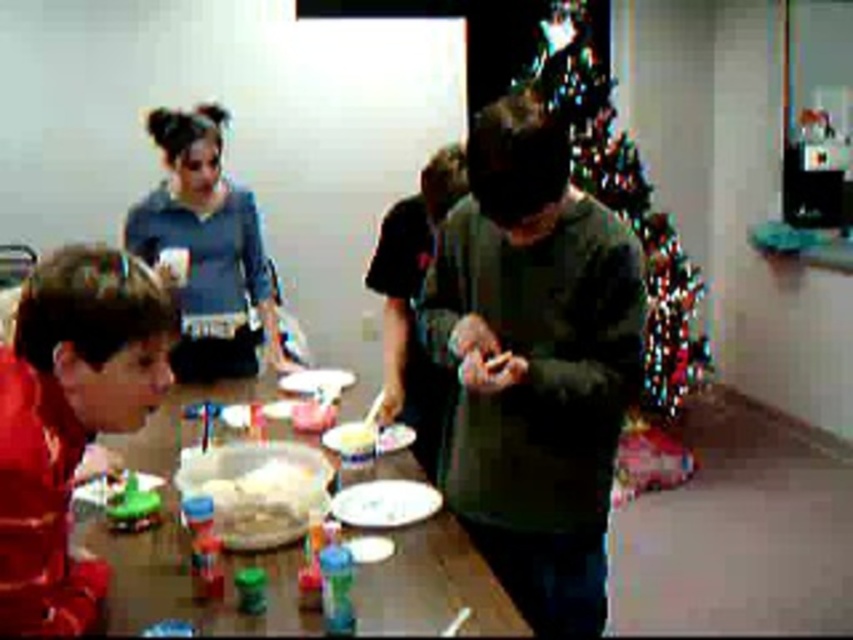
Between point (541, 365) and point (97, 289), which one is positioned behind?

Point (541, 365)

Is point (566, 444) closer to viewer compared to point (119, 392)?

That is False.

This screenshot has height=640, width=853. I want to click on dark green sweater at center, so click(534, 362).

Can you confirm if wooden table at lower left is positioned below blue fleece sweater at upper left?

Yes, wooden table at lower left is below blue fleece sweater at upper left.

Can you confirm if wooden table at lower left is thinner than blue fleece sweater at upper left?

No.

Between point (149, 426) and point (183, 195), which one is positioned in front?

Point (149, 426) is more forward.

Identify the location of wooden table at lower left. The image size is (853, 640). (189, 584).

In the scene shown: Is dark green sweater at center further to the viewer compared to white glossy plate at center?

No, it is in front of white glossy plate at center.

Between point (445, 346) and point (345, 518), which one is positioned in front?

Point (445, 346) is in front.

Identify the location of dark green sweater at center. (534, 362).